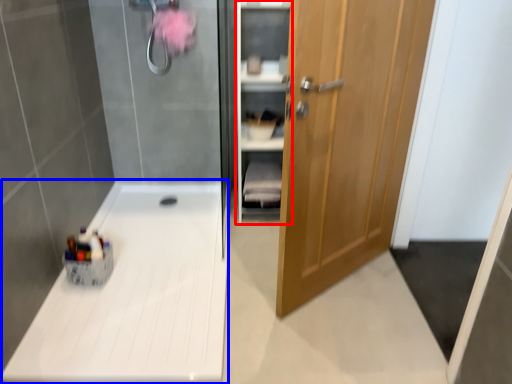
Question: Which of the following is the closest to the observer, cabinet (highlighted by a red box) or counter top (highlighted by a blue box)?

Choices:
 (A) cabinet
 (B) counter top

Answer: (B)